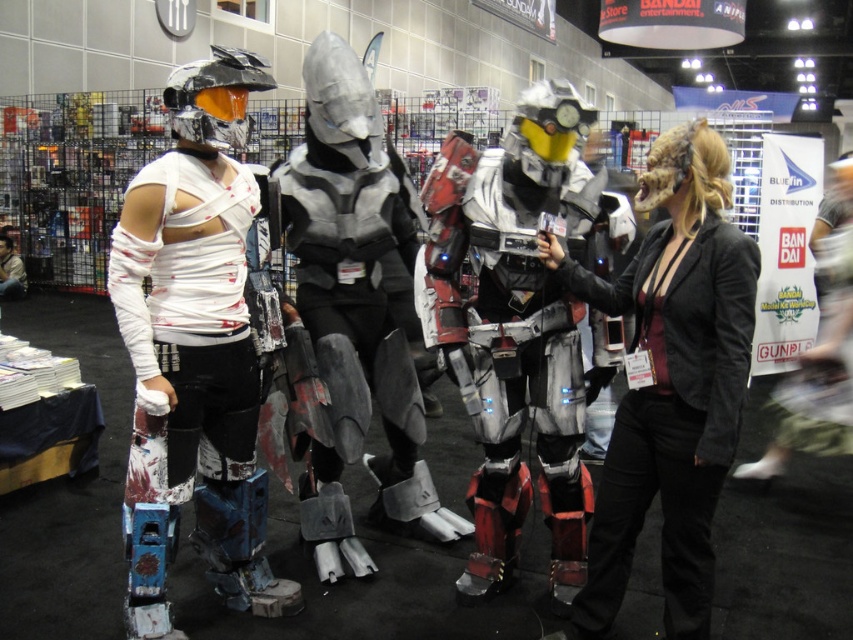
You are a photographer at the event and want to take a photo that includes both the red and white metallic armor at center and the silver metallic armor at center. Which armor should you focus on first to ensure both are in frame?

You should focus on the red and white metallic armor at center first since it is closer to the viewer, allowing the silver metallic armor at center to remain in the background of the frame.

You are a photographer at the event and want to take a photo of both the red and white metallic armor at center and the black leather jacket at center. However, you need to ensure that neither object is blocking the other in the shot. Based on their positions, which object should be closer to the camera to achieve this?

The red and white metallic armor at center should be closer to the camera because the black leather jacket at center is behind it. By positioning the red and white metallic armor at center in front, you can ensure that the black leather jacket at center is visible without being blocked.

You are at the convention and want to take a photo of the white bandaged armor at left and the black leather jacket at center. Which one should you focus on first if you want to capture both in the frame without moving your camera?

The white bandaged armor at left is to the left of the black leather jacket at center, so you should focus on the white bandaged armor at left first to ensure both are in the frame without moving the camera.